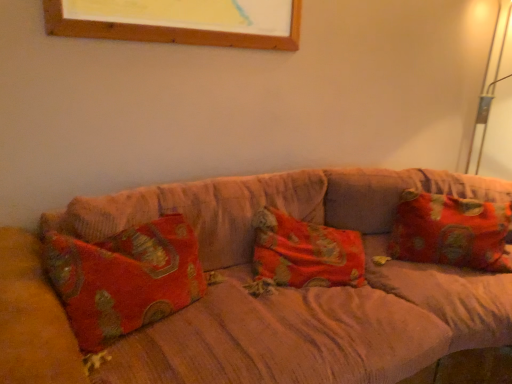
What are the coordinates of `velvet-like beige couch at center` in the screenshot? It's located at (266, 297).

Measure the distance between velvet-like beige couch at center and camera.

The depth of velvet-like beige couch at center is 34.63 inches.

What do you see at coordinates (266, 297) in the screenshot? I see `velvet-like beige couch at center` at bounding box center [266, 297].

What do you see at coordinates (451, 232) in the screenshot? I see `floral fabric pillow at right` at bounding box center [451, 232].

In order to click on floral fabric pillow at right in this screenshot , I will do `click(451, 232)`.

The width and height of the screenshot is (512, 384). Identify the location of velvet-like beige couch at center. (266, 297).

Consider the image. Can you confirm if floral fabric pillow at right is positioned to the left of velvet-like beige couch at center?

No, floral fabric pillow at right is not to the left of velvet-like beige couch at center.

Which object is further away from the camera, floral fabric pillow at right or velvet-like beige couch at center?

floral fabric pillow at right is further from the camera.

Which is in front, point (445, 228) or point (379, 295)?

Positioned in front is point (379, 295).

From the image's perspective, is floral fabric pillow at right beneath velvet-like beige couch at center?

No.

From a real-world perspective, is floral fabric pillow at right located beneath velvet-like beige couch at center?

No.

Considering the sizes of objects floral fabric pillow at right and velvet-like beige couch at center in the image provided, who is thinner, floral fabric pillow at right or velvet-like beige couch at center?

With smaller width is floral fabric pillow at right.

Is floral fabric pillow at right taller or shorter than velvet-like beige couch at center?

Clearly, floral fabric pillow at right is shorter compared to velvet-like beige couch at center.

Which of these two, floral fabric pillow at right or velvet-like beige couch at center, is bigger?

With larger size is velvet-like beige couch at center.

Can we say floral fabric pillow at right lies outside velvet-like beige couch at center?

Actually, floral fabric pillow at right is at least partially inside velvet-like beige couch at center.

Is floral fabric pillow at right next to velvet-like beige couch at center and touching it?

No, floral fabric pillow at right is not touching velvet-like beige couch at center.

Is velvet-like beige couch at center at the back of floral fabric pillow at right?

Correct, floral fabric pillow at right is looking away from velvet-like beige couch at center.

What's the angular difference between floral fabric pillow at right and velvet-like beige couch at center's facing directions?

The angular difference between floral fabric pillow at right and velvet-like beige couch at center is 32.5 degrees.

Measure the distance between floral fabric pillow at right and velvet-like beige couch at center.

The distance of floral fabric pillow at right from velvet-like beige couch at center is 45.11 centimeters.

Where is `pillow behind the velvet-like beige couch at center`? Image resolution: width=512 pixels, height=384 pixels. pillow behind the velvet-like beige couch at center is located at coordinates (451, 232).

Is velvet-like beige couch at center to the left of floral fabric pillow at right from the viewer's perspective?

Indeed, velvet-like beige couch at center is positioned on the left side of floral fabric pillow at right.

From the picture: Considering the relative positions of velvet-like beige couch at center and floral fabric pillow at right in the image provided, is velvet-like beige couch at center in front of floral fabric pillow at right?

Yes, the depth of velvet-like beige couch at center is less than that of floral fabric pillow at right.

Which is behind, point (41, 350) or point (390, 236)?

Point (390, 236)

From the image's perspective, which one is positioned lower, velvet-like beige couch at center or floral fabric pillow at right?

From the image's view, velvet-like beige couch at center is below.

From a real-world perspective, is velvet-like beige couch at center above or below floral fabric pillow at right?

Clearly, from a real-world perspective, velvet-like beige couch at center is below floral fabric pillow at right.

Which object is wider, velvet-like beige couch at center or floral fabric pillow at right?

With larger width is velvet-like beige couch at center.

Between velvet-like beige couch at center and floral fabric pillow at right, which one has more height?

velvet-like beige couch at center is taller.

Is velvet-like beige couch at center bigger or smaller than floral fabric pillow at right?

Clearly, velvet-like beige couch at center is larger in size than floral fabric pillow at right.

Is floral fabric pillow at right a part of velvet-like beige couch at center?

Yes, velvet-like beige couch at center is surrounding floral fabric pillow at right.

Would you consider velvet-like beige couch at center to be distant from floral fabric pillow at right?

No.

Is velvet-like beige couch at center looking in the opposite direction of floral fabric pillow at right?

Correct, velvet-like beige couch at center is looking away from floral fabric pillow at right.

Identify the location of pillow located above the velvet-like beige couch at center (from the image's perspective). (451, 232).

The height and width of the screenshot is (384, 512). In order to click on studio couch below the floral fabric pillow at right (from a real-world perspective) in this screenshot , I will do `click(266, 297)`.

This screenshot has height=384, width=512. I want to click on pillow that is on the right side of velvet-like beige couch at center, so click(x=451, y=232).